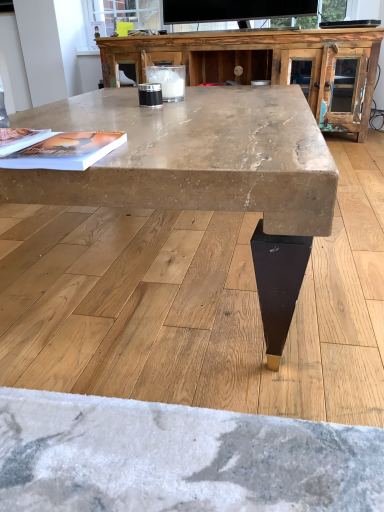
Question: Relative to marble-like wood coffee table at center, is rustic wood entertainment center at upper center in front or behind?

Choices:
 (A) front
 (B) behind

Answer: (B)

Question: Is rustic wood entertainment center at upper center spatially inside marble-like wood coffee table at center, or outside of it?

Choices:
 (A) outside
 (B) inside

Answer: (A)

Question: Based on their relative distances, which object is nearer to the matte paper magazine at center, the 2th magazine in the left-to-right sequence?

Choices:
 (A) rustic wood entertainment center at upper center
 (B) marble-like wood coffee table at center
 (C) matte paper magazine at upper left, placed as the first magazine when sorted from left to right

Answer: (C)

Question: Which object is the farthest from the marble-like wood coffee table at center?

Choices:
 (A) rustic wood entertainment center at upper center
 (B) matte paper magazine at center, the 2th magazine in the left-to-right sequence
 (C) matte paper magazine at upper left, which is the second magazine from right to left

Answer: (A)